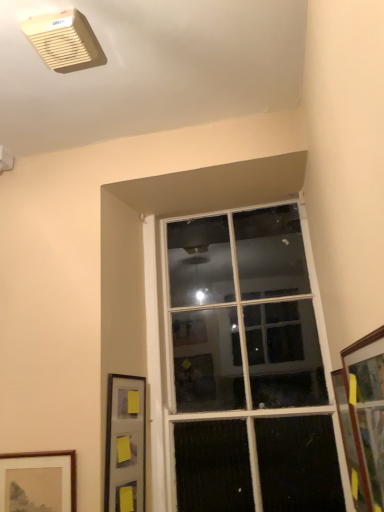
Question: From the image's perspective, is clear glass window at center above or below wooden framed picture at lower left, the third picture frame when ordered from right to left?

Choices:
 (A) above
 (B) below

Answer: (A)

Question: From their relative heights in the image, would you say clear glass window at center is taller or shorter than wooden framed picture at lower left, acting as the first picture frame starting from the left?

Choices:
 (A) short
 (B) tall

Answer: (B)

Question: Which object is positioned farthest from the wooden picture frame at right, the third picture frame positioned from the left?

Choices:
 (A) clear glass window at center
 (B) beige plastic air conditioning unit at upper left
 (C) matte gray picture frame at lower left, which appears as the third picture frame when viewed from the front
 (D) wooden framed picture at lower left, the third picture frame when ordered from right to left

Answer: (B)

Question: Based on their relative distances, which object is nearer to the wooden picture frame at right, arranged as the 1th picture frame when viewed from the right?

Choices:
 (A) matte gray picture frame at lower left, positioned as the second picture frame in left-to-right order
 (B) clear glass window at center
 (C) beige plastic air conditioning unit at upper left
 (D) wooden framed picture at lower left, which is counted as the 2th picture frame, starting from the back

Answer: (B)